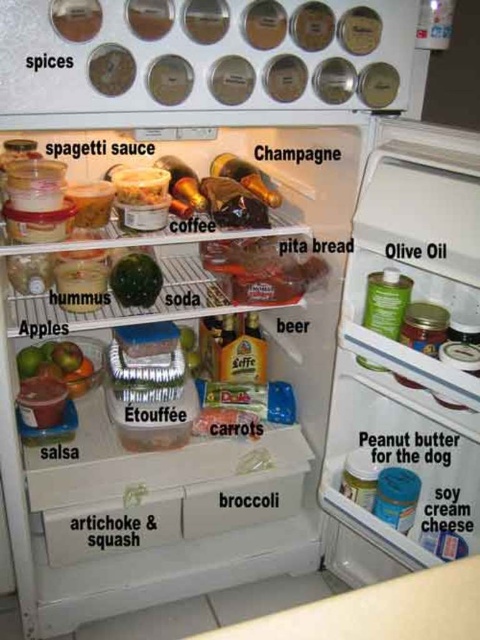
Looking at this image, you are standing in front of an open refrigerator and want to reach a point inside that is exactly at coordinates point (81, 381). If your arm can extend 1.6 meters, can you comfortably reach that point?

The distance of point (81, 381) from viewer is 1.55 meters, so yes, you can comfortably reach it since your arm can extend further than that distance.

What are the coordinates of the green matte apples at lower left?

The green matte apples at lower left are located at coordinates point (58,364).

You are organizing the fridge and need to place a new item on the shelf where the green matte apples at lower left and green matte watermelon at center are located. Which object is positioned higher on the shelf?

The green matte watermelon at center is positioned higher than the green matte apples at lower left.